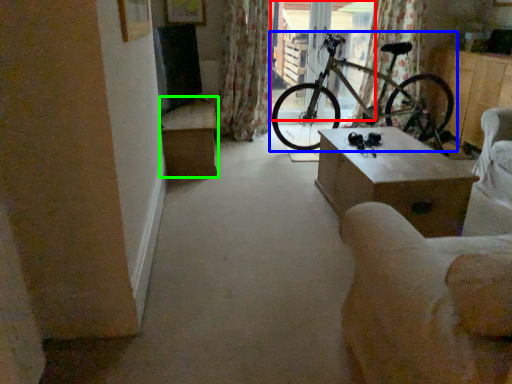
Question: Which is farther away from window screen (highlighted by a red box)? bicycle (highlighted by a blue box) or table (highlighted by a green box)?

Choices:
 (A) bicycle
 (B) table

Answer: (B)